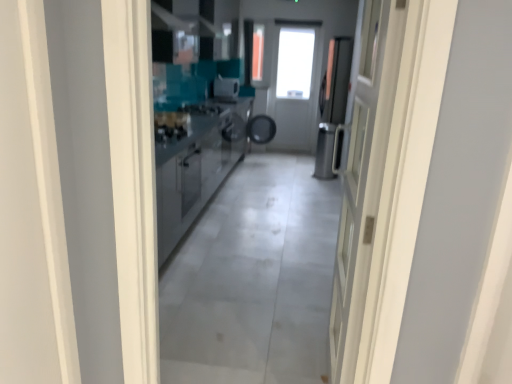
Locate an element on the screen. free point behind white glossy door at right is located at coordinates (289, 314).